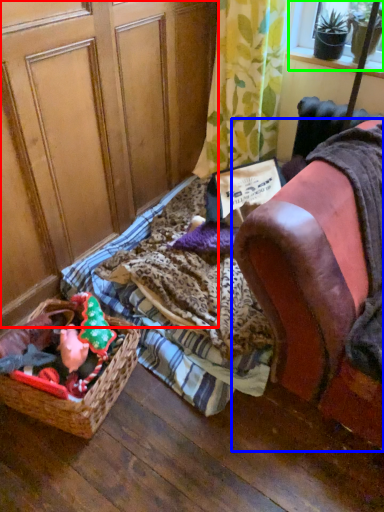
Question: Based on their relative distances, which object is farther from screen door (highlighted by a red box)? Choose from furniture (highlighted by a blue box) and window screen (highlighted by a green box).

Choices:
 (A) furniture
 (B) window screen

Answer: (B)